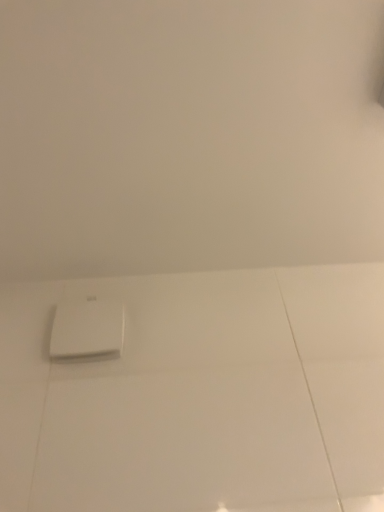
Measure the distance between white matte wall at upper center and camera.

They are 28.07 inches apart.

Identify the location of white matte wall at upper center. The height and width of the screenshot is (512, 384). (188, 135).

The height and width of the screenshot is (512, 384). What do you see at coordinates (188, 135) in the screenshot? I see `white matte wall at upper center` at bounding box center [188, 135].

What do you see at coordinates (87, 328) in the screenshot? I see `white plastic air vent at center` at bounding box center [87, 328].

Where is `white plastic air vent at center`? This screenshot has width=384, height=512. white plastic air vent at center is located at coordinates (87, 328).

Identify the location of white matte wall at upper center. The height and width of the screenshot is (512, 384). (188, 135).

Is white plastic air vent at center to the left of white matte wall at upper center from the viewer's perspective?

Yes.

Is the depth of white plastic air vent at center less than that of white matte wall at upper center?

That is False.

Considering the positions of point (74, 347) and point (380, 131), is point (74, 347) closer or farther from the camera than point (380, 131)?

Point (74, 347) is positioned farther from the camera compared to point (380, 131).

From the image's perspective, would you say white plastic air vent at center is shown under white matte wall at upper center?

Indeed, from the image's perspective, white plastic air vent at center is shown beneath white matte wall at upper center.

From a real-world perspective, is white plastic air vent at center positioned above or below white matte wall at upper center?

From a real-world perspective, white plastic air vent at center is physically below white matte wall at upper center.

Considering the relative sizes of white plastic air vent at center and white matte wall at upper center in the image provided, is white plastic air vent at center thinner than white matte wall at upper center?

Yes.

Who is shorter, white plastic air vent at center or white matte wall at upper center?

white matte wall at upper center.

Is white plastic air vent at center bigger than white matte wall at upper center?

No.

Choose the correct answer: Is white plastic air vent at center inside white matte wall at upper center or outside it?

white plastic air vent at center lies outside white matte wall at upper center.

Is the surface of white plastic air vent at center in direct contact with white matte wall at upper center?

There is a gap between white plastic air vent at center and white matte wall at upper center.

Is white plastic air vent at center positioned with its back to white matte wall at upper center?

white plastic air vent at center does not have its back to white matte wall at upper center.

How different are the orientations of white plastic air vent at center and white matte wall at upper center in degrees?

There is a 89.4-degree angle between the facing directions of white plastic air vent at center and white matte wall at upper center.

Where is `backdrop to the right of white plastic air vent at center`? The width and height of the screenshot is (384, 512). backdrop to the right of white plastic air vent at center is located at coordinates (188, 135).

From the picture: Can you confirm if white matte wall at upper center is positioned to the left of white plastic air vent at center?

Incorrect, white matte wall at upper center is not on the left side of white plastic air vent at center.

Considering the relative positions of white matte wall at upper center and white plastic air vent at center in the image provided, is white matte wall at upper center in front of white plastic air vent at center?

Yes.

Does point (12, 161) come behind point (97, 316)?

No.

From the image's perspective, which is below, white matte wall at upper center or white plastic air vent at center?

white plastic air vent at center, from the image's perspective.

From a real-world perspective, relative to white plastic air vent at center, is white matte wall at upper center vertically above or below?

From a real-world perspective, white matte wall at upper center is physically above white plastic air vent at center.

Considering the sizes of white matte wall at upper center and white plastic air vent at center in the image, is white matte wall at upper center wider or thinner than white plastic air vent at center?

white matte wall at upper center is wider than white plastic air vent at center.

In terms of height, does white matte wall at upper center look taller or shorter compared to white plastic air vent at center?

Considering their sizes, white matte wall at upper center has less height than white plastic air vent at center.

Who is bigger, white matte wall at upper center or white plastic air vent at center?

With larger size is white matte wall at upper center.

Is white plastic air vent at center a part of white matte wall at upper center?

No, white plastic air vent at center is located outside of white matte wall at upper center.

Is white matte wall at upper center far away from white plastic air vent at center?

No, white matte wall at upper center is not far away from white plastic air vent at center.

Is white matte wall at upper center oriented towards white plastic air vent at center?

No, white matte wall at upper center is not facing towards white plastic air vent at center.

I want to click on backdrop on the right of white plastic air vent at center, so click(188, 135).

This screenshot has width=384, height=512. I want to click on home appliance beneath the white matte wall at upper center (from a real-world perspective), so click(87, 328).

This screenshot has width=384, height=512. What are the coordinates of `backdrop located above the white plastic air vent at center (from a real-world perspective)` in the screenshot? It's located at (188, 135).